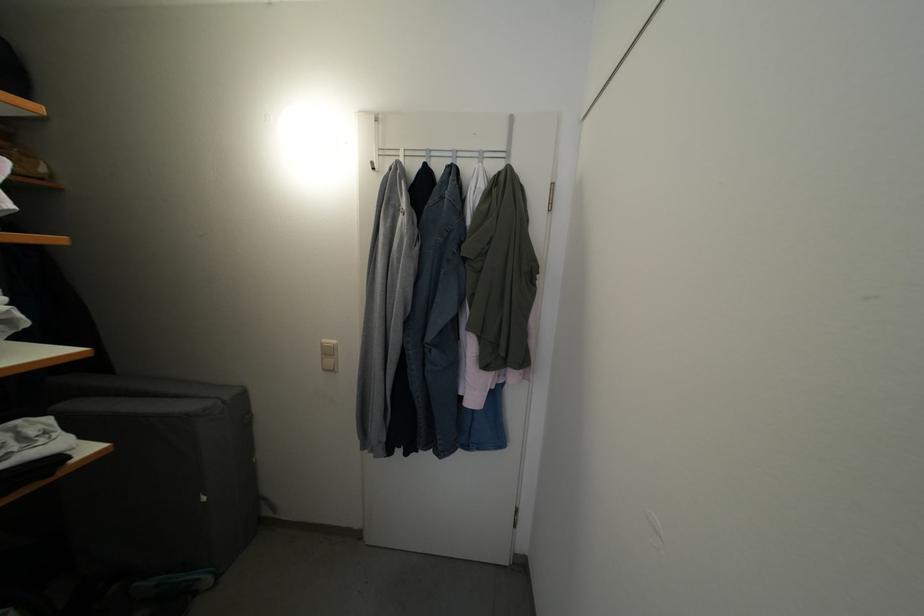
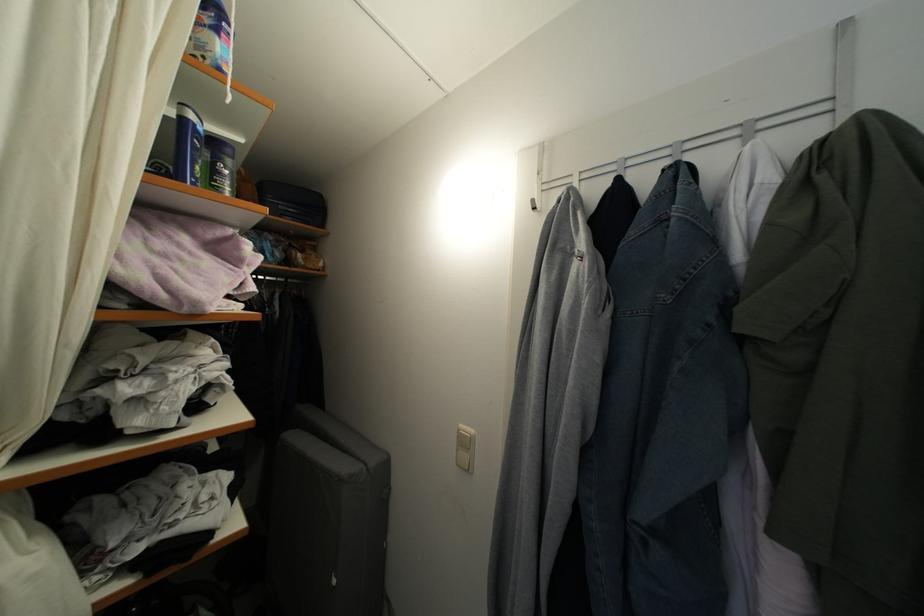
Locate, in the second image, the point that corresponds to (378,169) in the first image.

(538, 207)